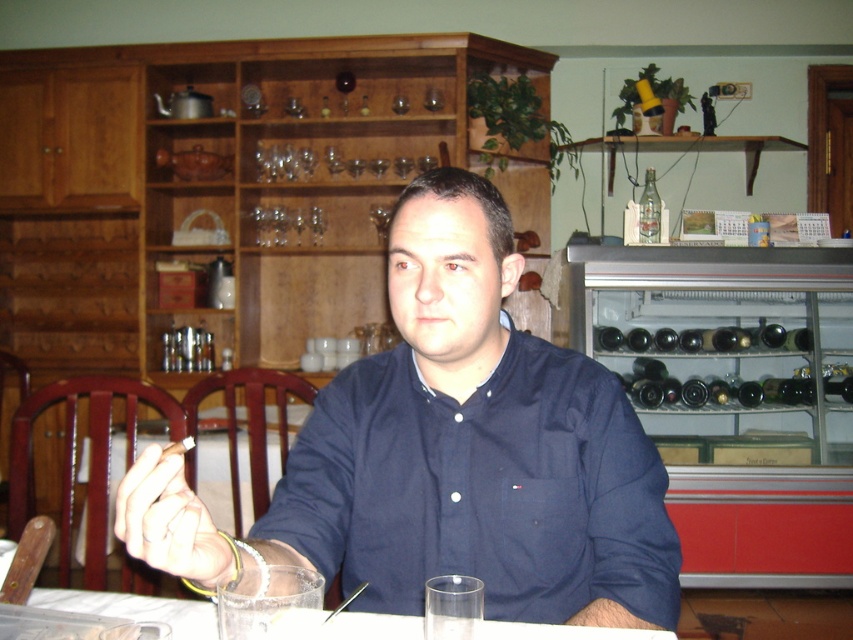
Locate an element on the screen. This screenshot has height=640, width=853. smooth leather hand at center is located at coordinates (169, 522).

The image size is (853, 640). I want to click on smooth leather hand at center, so click(169, 522).

Is clear plastic glass at lower center positioned behind clear glass bottle at upper center?

That is False.

Between point (271, 484) and point (647, 186), which one is positioned in front?

Point (271, 484) is more forward.

Describe the element at coordinates (215, 477) in the screenshot. I see `clear plastic glass at lower center` at that location.

Identify the location of clear plastic glass at lower center. (215, 477).

Between point (196, 465) and point (375, 205), which one is positioned behind?

The point (375, 205) is behind.

Does clear plastic glass at lower center have a greater height compared to transparent glass at center?

Correct, clear plastic glass at lower center is much taller as transparent glass at center.

Does point (245, 448) lie behind point (379, 230)?

No, (245, 448) is in front of (379, 230).

The width and height of the screenshot is (853, 640). Find the location of `clear plastic glass at lower center`. clear plastic glass at lower center is located at coordinates 215,477.